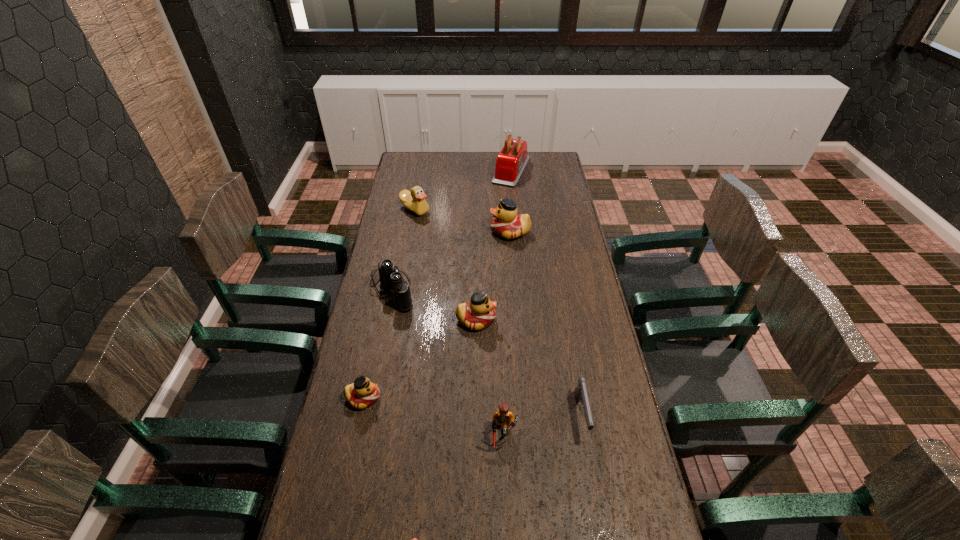
I want to click on red toaster, so click(x=511, y=161).

Find the location of a particular element. This screenshot has width=960, height=540. the farthest object is located at coordinates (511, 161).

The height and width of the screenshot is (540, 960). I want to click on the farthest red duck, so click(506, 223).

The width and height of the screenshot is (960, 540). What are the coordinates of `the second farthest duck` in the screenshot? It's located at (506, 223).

You are a GUI agent. You are given a task and a screenshot of the screen. Output one action in this format:
    pyautogui.click(x=<x>, y=<y>)
    Task: Click on the farther beige duck
    
    Given the screenshot: What is the action you would take?
    pyautogui.click(x=414, y=200)

Where is `the bigger beige duck`? The image size is (960, 540). the bigger beige duck is located at coordinates (414, 200).

You are a GUI agent. You are given a task and a screenshot of the screen. Output one action in this format:
    pyautogui.click(x=<x>, y=<y>)
    Task: Click on the binoculars
    
    Given the screenshot: What is the action you would take?
    pyautogui.click(x=391, y=278)

Find the location of a particular element. the third nearest duck is located at coordinates (479, 313).

Locate an element on the screen. This screenshot has height=540, width=960. the second biggest red duck is located at coordinates pyautogui.click(x=479, y=313).

What are the coordinates of `Lego` in the screenshot? It's located at (502, 417).